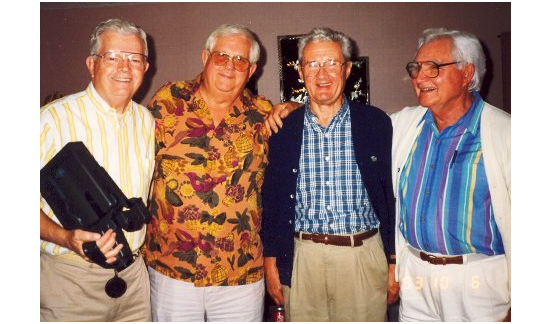
Where is `picture`? The image size is (550, 324). picture is located at coordinates (x=285, y=53).